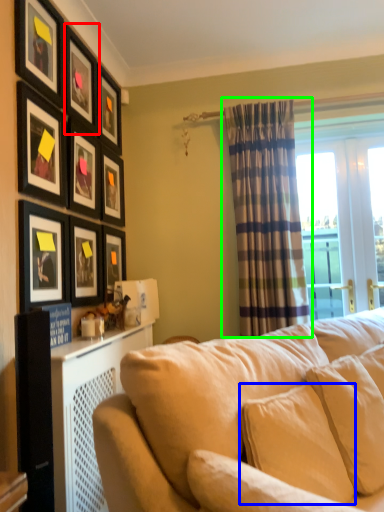
Question: Considering the real-world distances, which object is farthest from picture frame (highlighted by a red box)? pillow (highlighted by a blue box) or curtain (highlighted by a green box)?

Choices:
 (A) pillow
 (B) curtain

Answer: (A)